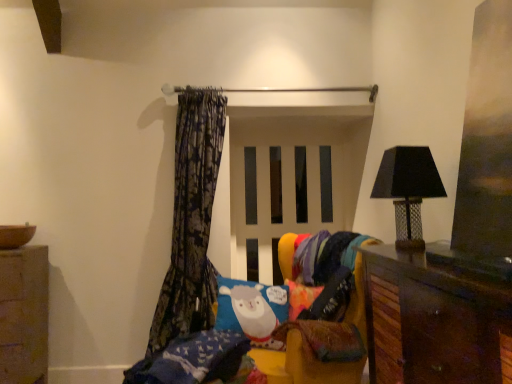
Measure the distance between point (163, 357) and camera.

Point (163, 357) and camera are 1.77 meters apart.

The width and height of the screenshot is (512, 384). What do you see at coordinates (275, 326) in the screenshot?
I see `soft plush bed at center` at bounding box center [275, 326].

Locate an element on the screen. Image resolution: width=512 pixels, height=384 pixels. dark floral fabric curtain at left is located at coordinates (191, 220).

From a real-world perspective, is smooth stone cabinet at lower left beneath multicolored knitted blanket at lower right?

Yes, from a real-world perspective, smooth stone cabinet at lower left is beneath multicolored knitted blanket at lower right.

Which of these two, smooth stone cabinet at lower left or multicolored knitted blanket at lower right, is bigger?

Bigger between the two is smooth stone cabinet at lower left.

Is smooth stone cabinet at lower left aimed at multicolored knitted blanket at lower right?

No, smooth stone cabinet at lower left is not oriented towards multicolored knitted blanket at lower right.

From a real-world perspective, which is physically below, smooth stone cabinet at lower left or dark floral fabric curtain at left?

From a 3D spatial view, smooth stone cabinet at lower left is below.

Between smooth stone cabinet at lower left and dark floral fabric curtain at left, which one has smaller width?

dark floral fabric curtain at left is thinner.

In terms of height, does smooth stone cabinet at lower left look taller or shorter compared to dark floral fabric curtain at left?

Clearly, smooth stone cabinet at lower left is shorter compared to dark floral fabric curtain at left.

Considering the sizes of objects smooth stone cabinet at lower left and brown wooden cabinet at lower right in the image provided, who is taller, smooth stone cabinet at lower left or brown wooden cabinet at lower right?

Standing taller between the two is smooth stone cabinet at lower left.

Which is behind, smooth stone cabinet at lower left or brown wooden cabinet at lower right?

smooth stone cabinet at lower left is behind.

Looking at their sizes, would you say smooth stone cabinet at lower left is wider or thinner than brown wooden cabinet at lower right?

Clearly, smooth stone cabinet at lower left has more width compared to brown wooden cabinet at lower right.

Is dark floral fabric curtain at left in front of or behind multicolored knitted blanket at lower right in the image?

Visually, dark floral fabric curtain at left is located behind multicolored knitted blanket at lower right.

Does point (180, 295) come behind point (336, 255)?

Yes, point (180, 295) is behind point (336, 255).

Between dark floral fabric curtain at left and multicolored knitted blanket at lower right, which one has less height?

Standing shorter between the two is multicolored knitted blanket at lower right.

How different are the orientations of dark floral fabric curtain at left and multicolored knitted blanket at lower right in degrees?

The angle between the facing direction of dark floral fabric curtain at left and the facing direction of multicolored knitted blanket at lower right is 55.7 degrees.

Is multicolored knitted blanket at lower right to the left of smooth stone cabinet at lower left from the viewer's perspective?

No, multicolored knitted blanket at lower right is not to the left of smooth stone cabinet at lower left.

Is multicolored knitted blanket at lower right facing away from smooth stone cabinet at lower left?

No, smooth stone cabinet at lower left is not at the back of multicolored knitted blanket at lower right.

The height and width of the screenshot is (384, 512). In the image, there is a multicolored knitted blanket at lower right. What are the coordinates of `cabinetry below it (from a real-world perspective)` in the screenshot? It's located at (24, 315).

What's the angular difference between multicolored knitted blanket at lower right and smooth stone cabinet at lower left's facing directions?

53.8 degrees separate the facing orientations of multicolored knitted blanket at lower right and smooth stone cabinet at lower left.

From their relative heights in the image, would you say dark floral fabric curtain at left is taller or shorter than soft plush bed at center?

Clearly, dark floral fabric curtain at left is taller compared to soft plush bed at center.

From a real-world perspective, does dark floral fabric curtain at left sit lower than soft plush bed at center?

Actually, dark floral fabric curtain at left is physically above soft plush bed at center in the real world.

Is dark floral fabric curtain at left positioned in front of soft plush bed at center?

No, it is not.

Does point (203, 176) come in front of point (140, 361)?

Yes, point (203, 176) is in front of point (140, 361).

Is dark floral fabric curtain at left touching black mesh lampshade at right?

No, dark floral fabric curtain at left is not next to black mesh lampshade at right.

Looking at this image, which object is positioned more to the left, dark floral fabric curtain at left or black mesh lampshade at right?

From the viewer's perspective, dark floral fabric curtain at left appears more on the left side.

Do you think dark floral fabric curtain at left is within black mesh lampshade at right, or outside of it?

dark floral fabric curtain at left lies outside black mesh lampshade at right.

Find the location of a particular element. This screenshot has height=384, width=512. cabinetry behind the multicolored knitted blanket at lower right is located at coordinates (24, 315).

Locate an element on the screen. The image size is (512, 384). cabinetry on the left side of dark floral fabric curtain at left is located at coordinates (24, 315).

Considering their positions, is brown wooden cabinet at lower right positioned further to black mesh lampshade at right than multicolored knitted blanket at lower right?

The object further to black mesh lampshade at right is multicolored knitted blanket at lower right.

When comparing their distances from dark floral fabric curtain at left, does smooth stone cabinet at lower left or brown wooden cabinet at lower right seem closer?

smooth stone cabinet at lower left is closer to dark floral fabric curtain at left.

Based on their spatial positions, is smooth stone cabinet at lower left or soft plush bed at center further from multicolored knitted blanket at lower right?

smooth stone cabinet at lower left is positioned further to the anchor multicolored knitted blanket at lower right.

Which object lies further to the anchor point multicolored knitted blanket at lower right, dark floral fabric curtain at left or black mesh lampshade at right?

Based on the image, dark floral fabric curtain at left appears to be further to multicolored knitted blanket at lower right.

From the image, which object appears to be nearer to dark floral fabric curtain at left, multicolored knitted blanket at lower right or soft plush bed at center?

Based on the image, soft plush bed at center appears to be nearer to dark floral fabric curtain at left.

From the image, which object appears to be farther from black mesh lampshade at right, multicolored knitted blanket at lower right or soft plush bed at center?

The object further to black mesh lampshade at right is soft plush bed at center.

When comparing their distances from multicolored knitted blanket at lower right, does black mesh lampshade at right or brown wooden cabinet at lower right seem closer?

The object closer to multicolored knitted blanket at lower right is black mesh lampshade at right.

From the image, which object appears to be nearer to smooth stone cabinet at lower left, black mesh lampshade at right or brown wooden cabinet at lower right?

brown wooden cabinet at lower right is closer to smooth stone cabinet at lower left.

This screenshot has width=512, height=384. Identify the location of bed between smooth stone cabinet at lower left and black mesh lampshade at right. (275, 326).

Find the location of a particular element. fabric between dark floral fabric curtain at left and black mesh lampshade at right from left to right is located at coordinates (322, 274).

The width and height of the screenshot is (512, 384). Identify the location of bed located between dark floral fabric curtain at left and black mesh lampshade at right in the left-right direction. (275, 326).

The width and height of the screenshot is (512, 384). I want to click on lamp positioned between brown wooden cabinet at lower right and dark floral fabric curtain at left from near to far, so click(408, 185).